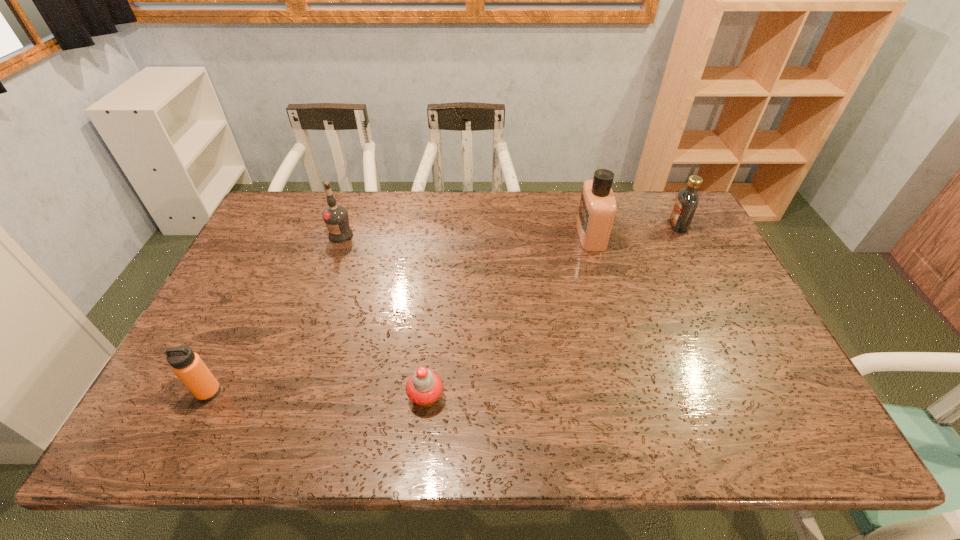
What are the coordinates of `vacant space located on the front-facing side of the right vodka` in the screenshot? It's located at (595, 226).

What are the coordinates of `free region located 0.280m on the front-facing side of the right vodka` in the screenshot? It's located at (586, 226).

Where is `free location located 0.260m on the front-facing side of the right vodka`? free location located 0.260m on the front-facing side of the right vodka is located at coordinates (592, 226).

Locate an element on the screen. vacant area situated 0.400m on the right of the thermos bottle is located at coordinates (391, 392).

Find the location of a particular element. The image size is (960, 540). free space located on the back of the third object from right to left is located at coordinates (438, 271).

This screenshot has width=960, height=540. In order to click on perfume located in the far edge section of the desktop in this screenshot , I will do `click(597, 208)`.

Find the location of a particular element. This screenshot has width=960, height=540. object at the near edge is located at coordinates (424, 387).

Locate an element on the screen. Image resolution: width=960 pixels, height=540 pixels. object that is at the left edge is located at coordinates (187, 365).

You are a GUI agent. You are given a task and a screenshot of the screen. Output one action in this format:
    pyautogui.click(x=<x>, y=<y>)
    Task: Click on the object located in the right edge section of the desktop
    The height and width of the screenshot is (540, 960).
    Given the screenshot: What is the action you would take?
    pyautogui.click(x=687, y=201)

The image size is (960, 540). I want to click on object that is at the far right corner, so click(687, 201).